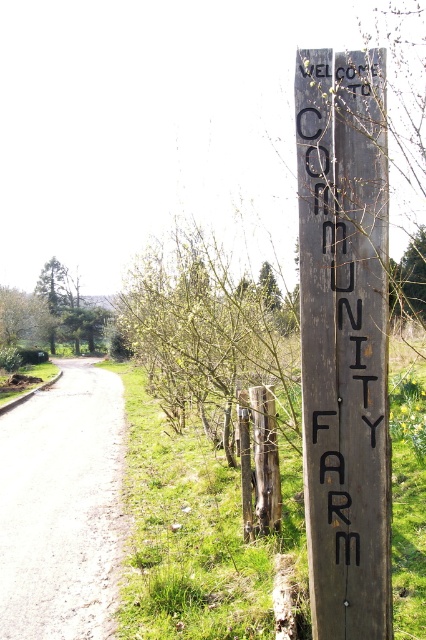
You are standing at the entrance of the community farm and see two points marked on the ground. The first point is at coordinate point (388, 435) and the second point is at coordinate point (397, 592). Which point is closer to you?

Point (388, 435) is closer to the camera than point (397, 592), so the first point is closer to you.